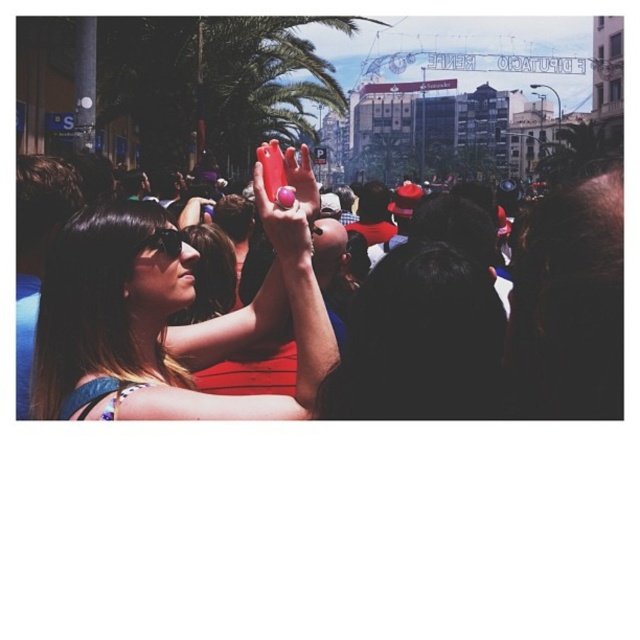
Is point (160, 404) closer to camera compared to point (176, 252)?

That is True.

Which is more to the right, matte red phone at center or matte black goggles at center?

From the viewer's perspective, matte red phone at center appears more on the right side.

Is point (230, 314) closer to camera compared to point (138, 243)?

No.

Locate an element on the screen. This screenshot has height=640, width=640. matte red phone at center is located at coordinates (168, 316).